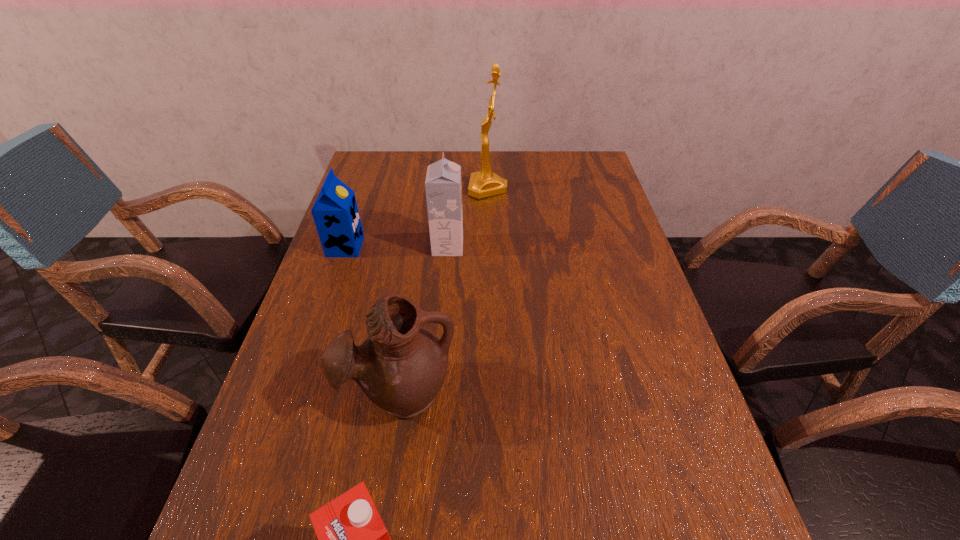
Find the location of a particular element. free location located with the cap open on the leftmost object is located at coordinates (493, 247).

You are a GUI agent. You are given a task and a screenshot of the screen. Output one action in this format:
    pyautogui.click(x=<x>, y=<y>)
    Task: Click on the object that is positioned at the far edge
    This screenshot has width=960, height=540.
    Given the screenshot: What is the action you would take?
    pyautogui.click(x=484, y=183)

I want to click on pitcher present at the left edge, so click(402, 365).

The height and width of the screenshot is (540, 960). What are the coordinates of `carton that is at the left edge` in the screenshot? It's located at (335, 212).

What are the coordinates of `vacant space at the far edge of the desktop` in the screenshot? It's located at 524,152.

Image resolution: width=960 pixels, height=540 pixels. Find the location of `free spot at the right edge of the desktop`. free spot at the right edge of the desktop is located at coordinates (611, 369).

The image size is (960, 540). Identify the location of vacant region at the far left corner of the desktop. (384, 163).

The image size is (960, 540). Identify the location of free space between the tallest carton and the leftmost carton. (396, 247).

What are the coordinates of `blank region between the tallest carton and the leftmost object` in the screenshot? It's located at (396, 247).

At what (x,y) coordinates should I click in order to perform the action: click on the third closest object to the pitcher. Please return your answer as a coordinate pair (x, y). Looking at the image, I should click on (443, 187).